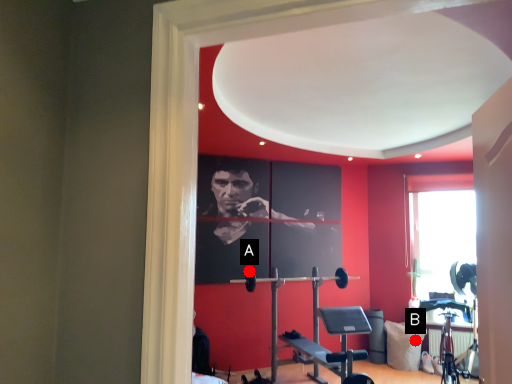
Question: Two points are circled on the image, labeled by A and B beside each circle. Which point is closer to the camera?

Choices:
 (A) A is closer
 (B) B is closer

Answer: (B)